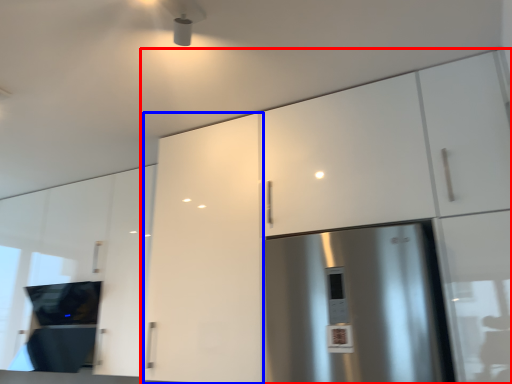
Question: Which of the following is the farthest to the observer, cabinetry (highlighted by a red box) or cabinetry (highlighted by a blue box)?

Choices:
 (A) cabinetry
 (B) cabinetry

Answer: (B)